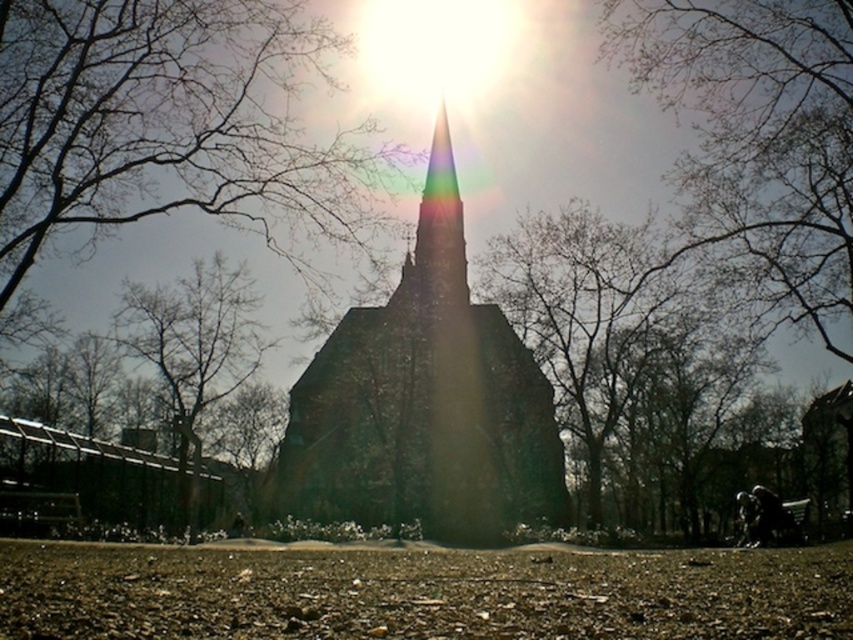
You are standing in the outdoor scene looking at the church spire. There are two points marked in the image. The first point is at coordinates point (x=825, y=301) and the second is at point (x=664, y=326). Which point is closer to you?

Point (x=825, y=301) is closer to the camera than point (x=664, y=326).

You are an archer standing at the base of the church spire. You have an arrow that can travel 100 meters. If you aim at the bare branches at upper center, will your arrow reach them?

The distance of the bare branches at upper center from the viewer is 107.37 meters. Since the arrow can only travel 100 meters, it will not reach the bare branches at upper center.

You are a bird flying towards the church spire. You see the bare branches at upper center and the green leafy tree at center. Which one is closer to you?

The green leafy tree at center is closer to you since the distance between the bare branches at upper center and the green leafy tree at center is 20.05 meters, implying the green leafy tree is nearer than the bare branches.